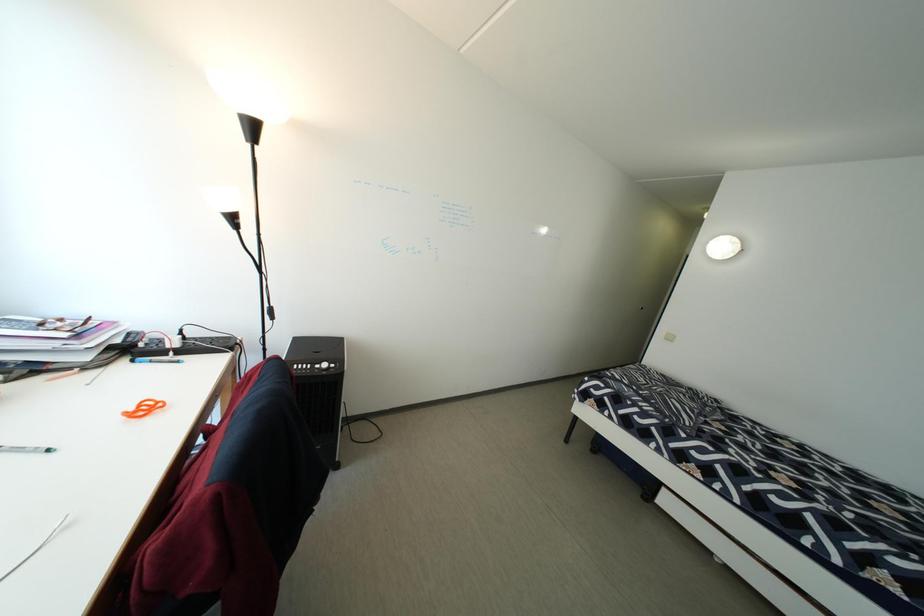
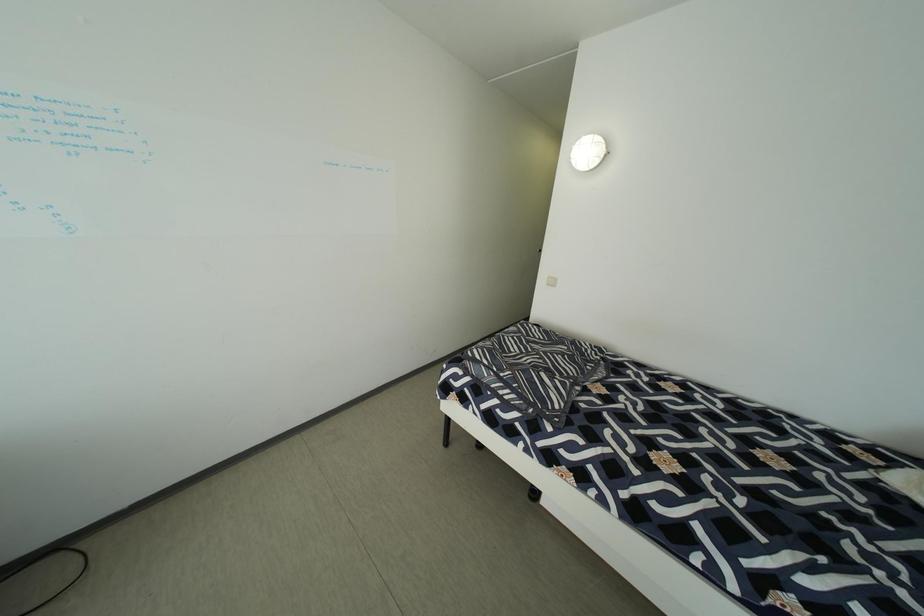
The images are taken continuously from a first-person perspective. In which direction are you moving?

The cameraman walked toward right, forward.